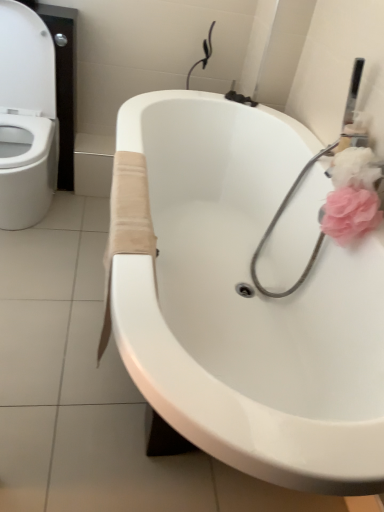
Question: From the image's perspective, relative to pink fluffy sponge at upper right, the second flower in the top-to-bottom sequence, is pink fluffy flower at upper right, which is the 1th flower in top-to-bottom order, above or below?

Choices:
 (A) below
 (B) above

Answer: (B)

Question: Based on their sizes in the image, would you say pink fluffy flower at upper right, acting as the second flower starting from the bottom, is bigger or smaller than pink fluffy sponge at upper right, acting as the first flower starting from the bottom?

Choices:
 (A) small
 (B) big

Answer: (A)

Question: Which of these objects is positioned farthest from the white glossy bathtub at center?

Choices:
 (A) white glossy toilet at left
 (B) pink fluffy flower at upper right, which is the 1th flower in top-to-bottom order
 (C) beige fabric towel at lower center
 (D) pink fluffy sponge at upper right, the second flower in the top-to-bottom sequence

Answer: (A)

Question: Which object is positioned closest to the pink fluffy flower at upper right, acting as the second flower starting from the bottom?

Choices:
 (A) beige fabric towel at lower center
 (B) white glossy toilet at left
 (C) white glossy bathtub at center
 (D) pink fluffy sponge at upper right, the second flower in the top-to-bottom sequence

Answer: (D)